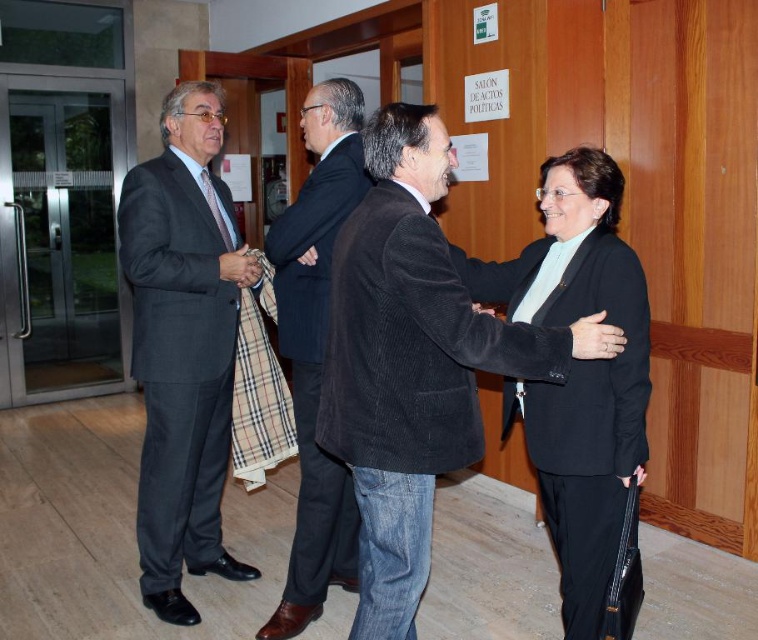
Can you confirm if dark corduroy blazer at center is positioned above matte black hand at upper right?

No, dark corduroy blazer at center is not above matte black hand at upper right.

Who is shorter, dark corduroy blazer at center or matte black hand at upper right?

With less height is matte black hand at upper right.

Image resolution: width=758 pixels, height=640 pixels. In order to click on dark corduroy blazer at center in this screenshot , I will do `click(409, 362)`.

Who is taller, dark gray suit at left or matte black hand at upper right?

Standing taller between the two is dark gray suit at left.

Is the position of dark gray suit at left more distant than that of matte black hand at upper right?

That is True.

Which is behind, point (152, 538) or point (600, 324)?

Point (152, 538)

The image size is (758, 640). I want to click on dark gray suit at left, so click(183, 346).

Is black matte blazer at center above matte black hand at upper right?

No.

Find the location of `black matte blazer at center`. black matte blazer at center is located at coordinates (578, 372).

In order to click on black matte blazer at center in this screenshot , I will do `click(578, 372)`.